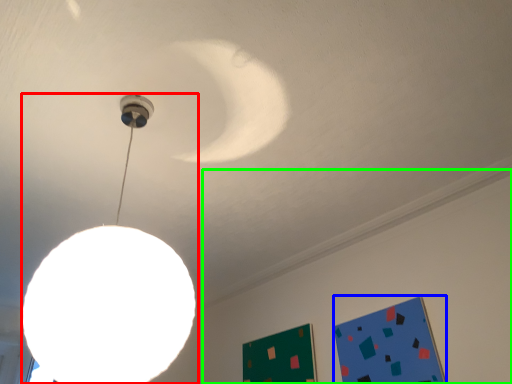
Question: Which is nearer to the lamp (highlighted by a red box)? bulletin board (highlighted by a blue box) or backdrop (highlighted by a green box).

Choices:
 (A) bulletin board
 (B) backdrop

Answer: (A)